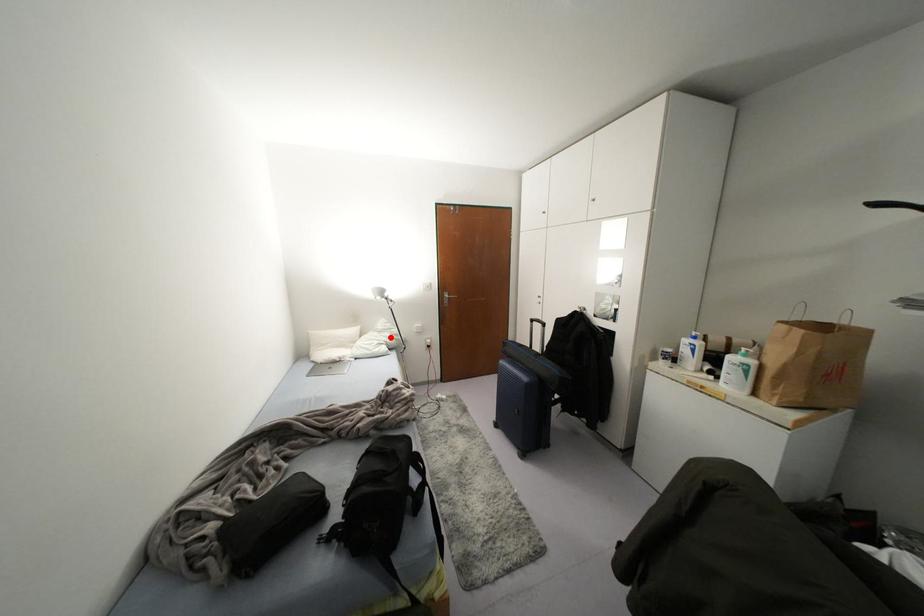
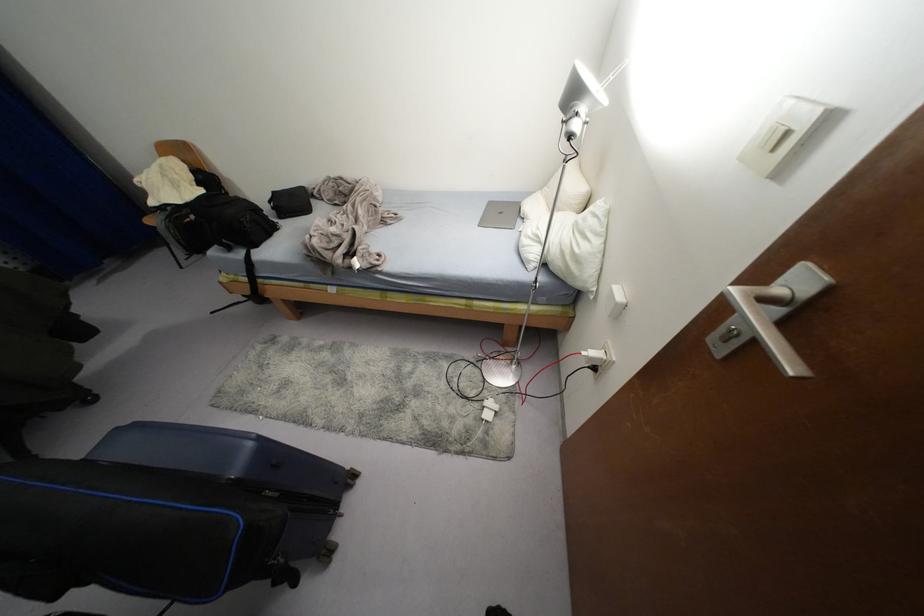
Question: A red point is marked in image1. In image2, is the corresponding 3D point closer to the camera or farther? Reply with the corresponding letter.

Choices:
 (A) The corresponding 3D point is closer.
 (B) The corresponding 3D point is farther.

Answer: (A)